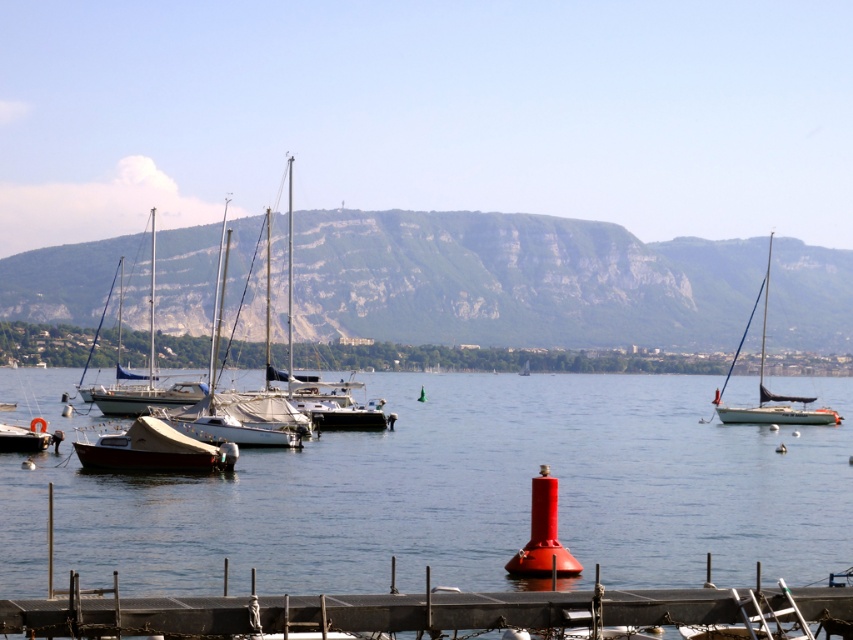
You are standing at the center of the wooden pier and want to reach the wooden sailboat at lower left. Which direction should you walk to get there? The wooden pier extends into the lake from the shore. The wooden sailboat at lower left is located at point (155, 449). Your current position is at the center of the pier. Based on the coordinates, the sailboat is to your left side relative to the pier direction. Therefore, you should walk towards the left side of the pier to reach it.

Walk towards the left side of the wooden pier to reach the wooden sailboat at lower left.

You are standing on the wooden pier and see two points in the scene. One is at point coordinates point (x=788, y=408) and the other is at point (x=15, y=428). Which point is closer to you?

Point (x=788, y=408) is further to the viewer than point (x=15, y=428), so the point closer to you is point (x=15, y=428).